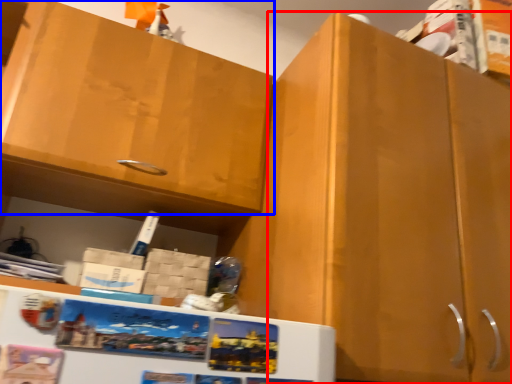
Question: Which of the following is the closest to the observer, cabinetry (highlighted by a red box) or cabinetry (highlighted by a blue box)?

Choices:
 (A) cabinetry
 (B) cabinetry

Answer: (A)